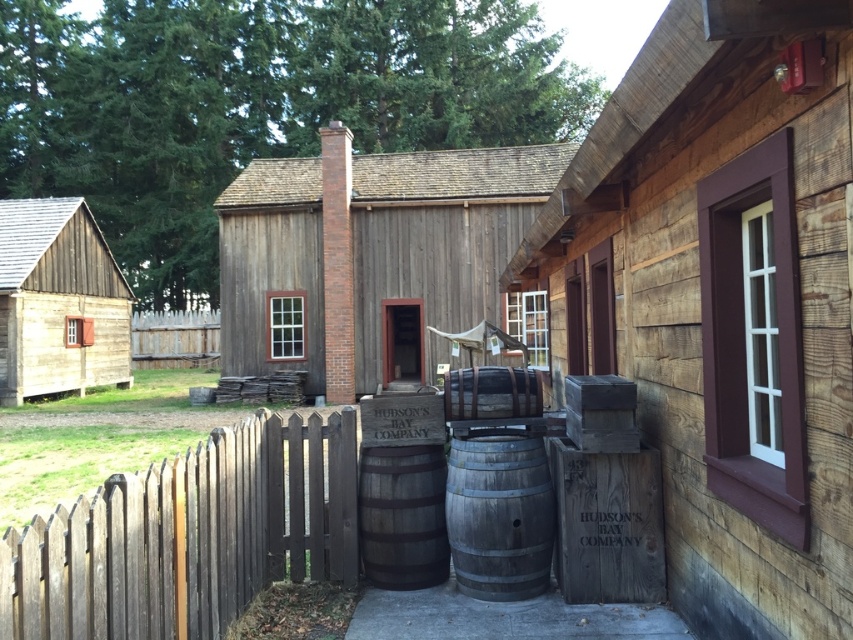
Consider the image. Does wooden crate at center have a lesser width compared to wooden cabin at left?

No.

Between point (730, 26) and point (82, 320), which one is positioned in front?

Positioned in front is point (730, 26).

At what (x,y) coordinates should I click in order to perform the action: click on wooden crate at center. Please return your answer as a coordinate pair (x, y). Looking at the image, I should click on (723, 300).

Can you confirm if rustic wooden barrel at center is positioned to the right of wooden barrel at center?

No, rustic wooden barrel at center is not to the right of wooden barrel at center.

Based on the photo, does rustic wooden barrel at center have a lesser height compared to wooden barrel at center?

Incorrect, rustic wooden barrel at center's height does not fall short of wooden barrel at center's.

Which is behind, point (430, 532) or point (508, 372)?

The point (508, 372) is behind.

Find the location of a particular element. The image size is (853, 640). rustic wooden barrel at center is located at coordinates (402, 515).

Between wooden cabin at center and wooden picket fence at center, which one appears on the right side from the viewer's perspective?

wooden cabin at center

Consider the image. Does wooden cabin at center come behind wooden picket fence at center?

No, wooden cabin at center is closer to the viewer.

Locate an element on the screen. This screenshot has height=640, width=853. wooden cabin at center is located at coordinates (370, 257).